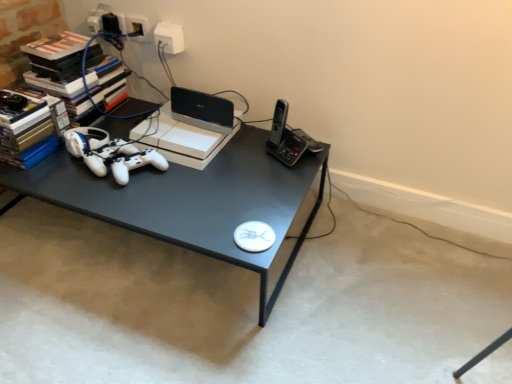
Question: Is white matte game controller at center completely or partially inside white plastic outlet at upper center?

Choices:
 (A) yes
 (B) no

Answer: (B)

Question: Considering the relative positions of white plastic outlet at upper center and white matte game controller at center in the image provided, is white plastic outlet at upper center behind white matte game controller at center?

Choices:
 (A) no
 (B) yes

Answer: (B)

Question: Is white plastic outlet at upper center to the left of white matte game controller at center from the viewer's perspective?

Choices:
 (A) no
 (B) yes

Answer: (A)

Question: Is white plastic outlet at upper center positioned with its back to white matte game controller at center?

Choices:
 (A) yes
 (B) no

Answer: (B)

Question: Is white plastic outlet at upper center closer to the viewer compared to white matte game controller at center?

Choices:
 (A) yes
 (B) no

Answer: (B)

Question: From the image's perspective, is matte black desk at center located above or below white plastic outlet at upper center?

Choices:
 (A) above
 (B) below

Answer: (B)

Question: Does point (123, 137) appear closer or farther from the camera than point (179, 38)?

Choices:
 (A) closer
 (B) farther

Answer: (A)

Question: From a real-world perspective, is matte black desk at center positioned above or below white plastic outlet at upper center?

Choices:
 (A) above
 (B) below

Answer: (B)

Question: Based on their positions, is matte black desk at center located to the left or right of white plastic outlet at upper center?

Choices:
 (A) left
 (B) right

Answer: (A)

Question: From a real-world perspective, is black plastic router at upper center physically located above or below white matte game controller at center?

Choices:
 (A) above
 (B) below

Answer: (A)

Question: Would you say black plastic router at upper center is to the left or to the right of white matte game controller at center in the picture?

Choices:
 (A) left
 (B) right

Answer: (B)

Question: Considering the positions of point (205, 117) and point (122, 150), is point (205, 117) closer or farther from the camera than point (122, 150)?

Choices:
 (A) farther
 (B) closer

Answer: (A)

Question: From the image's perspective, is black plastic router at upper center above or below white matte game controller at center?

Choices:
 (A) below
 (B) above

Answer: (B)

Question: In terms of width, does black plastic router at upper center look wider or thinner when compared to matte black desk at center?

Choices:
 (A) wide
 (B) thin

Answer: (B)

Question: Looking at the image, does black plastic router at upper center seem bigger or smaller compared to matte black desk at center?

Choices:
 (A) small
 (B) big

Answer: (A)